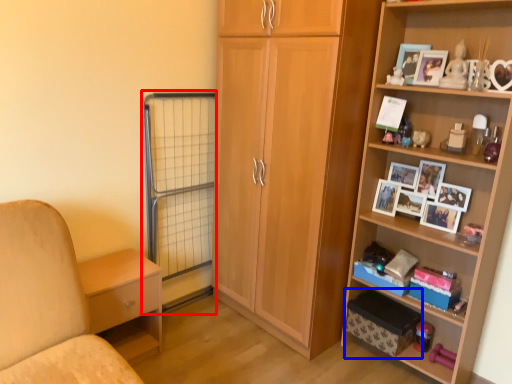
Question: Which point is closer to the camera, screen door (highlighted by a red box) or storage box (highlighted by a blue box)?

Choices:
 (A) screen door
 (B) storage box

Answer: (B)